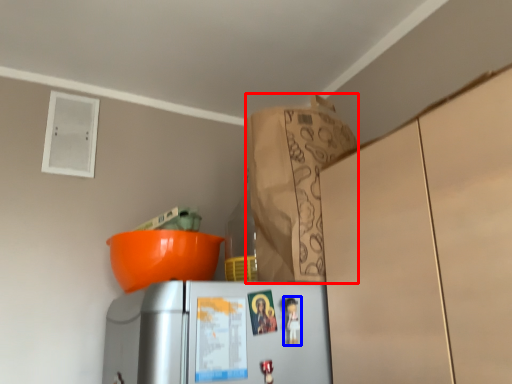
Question: Which of the following is the farthest to the observer, paper bag (highlighted by a red box) or toy (highlighted by a blue box)?

Choices:
 (A) paper bag
 (B) toy

Answer: (A)